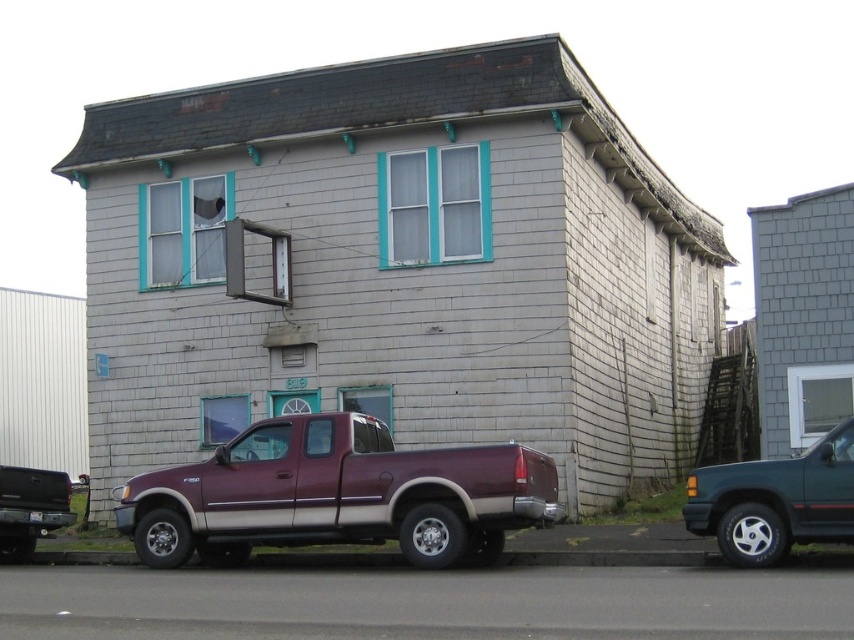
You are standing in front of the two story residential building and see two trucks. Which one is more to the right? The maroon metallic truck at center or the maroon matte truck at center?

The maroon metallic truck at center is positioned on the right side of the maroon matte truck at center, so it is more to the right.